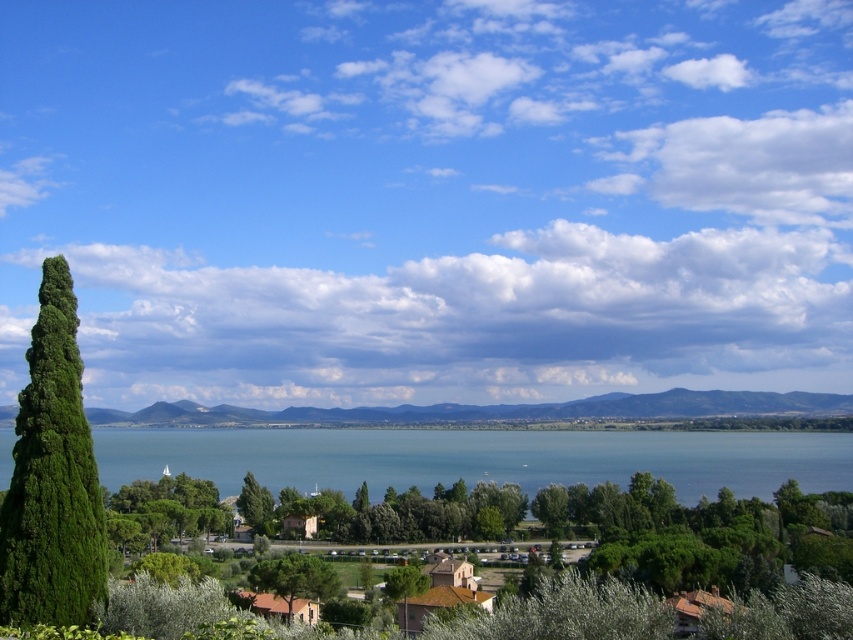
Question: Which point is farther to the camera?

Choices:
 (A) blue water at center
 (B) green leafy cypress at left

Answer: (B)

Question: Which point is closer to the camera?

Choices:
 (A) (54, 513)
 (B) (741, 442)

Answer: (A)

Question: Is blue water at center above green leafy cypress at left?

Choices:
 (A) no
 (B) yes

Answer: (A)

Question: Which point is closer to the camera?

Choices:
 (A) (45, 426)
 (B) (149, 461)

Answer: (A)

Question: Is blue water at center positioned behind green leafy cypress at left?

Choices:
 (A) no
 (B) yes

Answer: (A)

Question: Is blue water at center to the right of green leafy cypress at left from the viewer's perspective?

Choices:
 (A) no
 (B) yes

Answer: (A)